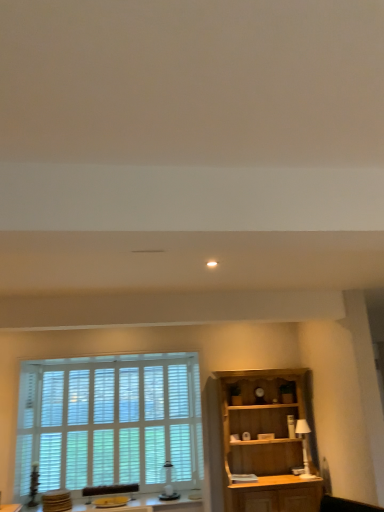
Question: From a real-world perspective, is white glossy lamp at right beneath white wood blinds at left?

Choices:
 (A) yes
 (B) no

Answer: (A)

Question: Could you tell me if white glossy lamp at right is facing white wood blinds at left?

Choices:
 (A) yes
 (B) no

Answer: (B)

Question: Is white glossy lamp at right to the left of white wood blinds at left from the viewer's perspective?

Choices:
 (A) no
 (B) yes

Answer: (A)

Question: Considering the relative sizes of white glossy lamp at right and white wood blinds at left in the image provided, is white glossy lamp at right thinner than white wood blinds at left?

Choices:
 (A) yes
 (B) no

Answer: (B)

Question: From a real-world perspective, is white glossy lamp at right on white wood blinds at left?

Choices:
 (A) no
 (B) yes

Answer: (A)

Question: Is white glossy lamp at right beside white wood blinds at left?

Choices:
 (A) no
 (B) yes

Answer: (A)

Question: Does white glossy lamp at right appear on the right side of wooden table at lower center?

Choices:
 (A) no
 (B) yes

Answer: (B)

Question: Does white glossy lamp at right have a lesser height compared to wooden table at lower center?

Choices:
 (A) yes
 (B) no

Answer: (B)

Question: Can you confirm if white glossy lamp at right is smaller than wooden table at lower center?

Choices:
 (A) yes
 (B) no

Answer: (A)

Question: Is white glossy lamp at right completely or partially outside of wooden table at lower center?

Choices:
 (A) no
 (B) yes

Answer: (B)

Question: From the image's perspective, would you say white glossy lamp at right is positioned over wooden table at lower center?

Choices:
 (A) yes
 (B) no

Answer: (A)

Question: Does white glossy lamp at right turn towards wooden table at lower center?

Choices:
 (A) no
 (B) yes

Answer: (A)

Question: Is white wood blinds at left to the right of white glossy lamp at right from the viewer's perspective?

Choices:
 (A) no
 (B) yes

Answer: (A)